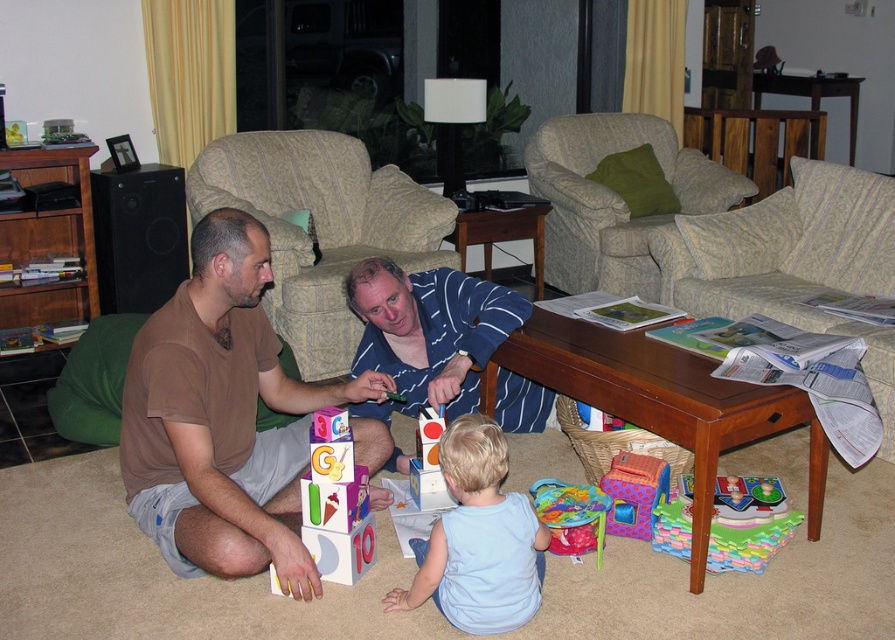
Which is below, green fabric couch at center or plastic colorful playhouse at lower center?

Positioned lower is plastic colorful playhouse at lower center.

What do you see at coordinates (793, 260) in the screenshot?
I see `green fabric couch at center` at bounding box center [793, 260].

Is point (885, 241) positioned in front of point (611, 476)?

No, (885, 241) is behind (611, 476).

This screenshot has height=640, width=895. In order to click on green fabric couch at center in this screenshot , I will do `click(793, 260)`.

Does matte plastic drum at lower center have a lesser width compared to plastic colorful playhouse at lower center?

In fact, matte plastic drum at lower center might be wider than plastic colorful playhouse at lower center.

The image size is (895, 640). I want to click on matte plastic drum at lower center, so click(x=570, y=515).

Is point (584, 524) less distant than point (624, 467)?

That is True.

The image size is (895, 640). Find the location of `matte plastic drum at lower center`. matte plastic drum at lower center is located at coordinates (570, 515).

Based on the photo, does light blue cotton shirt at lower center appear on the right side of matte plastic drum at lower center?

Incorrect, light blue cotton shirt at lower center is not on the right side of matte plastic drum at lower center.

Looking at this image, can you confirm if light blue cotton shirt at lower center is thinner than matte plastic drum at lower center?

In fact, light blue cotton shirt at lower center might be wider than matte plastic drum at lower center.

Is point (486, 474) farther from viewer compared to point (552, 508)?

That is False.

Locate an element on the screen. This screenshot has height=640, width=895. light blue cotton shirt at lower center is located at coordinates (478, 538).